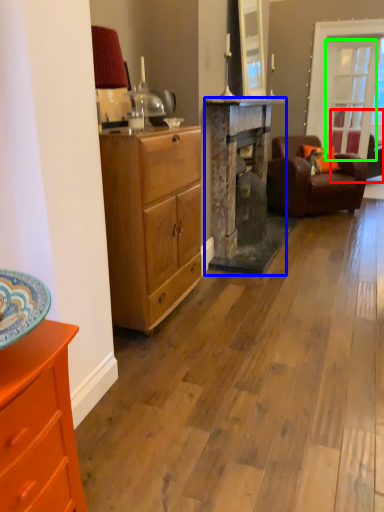
Question: Which is nearer to the studio couch (highlighted by a red box)? fireplace (highlighted by a blue box) or glass door (highlighted by a green box).

Choices:
 (A) fireplace
 (B) glass door

Answer: (B)